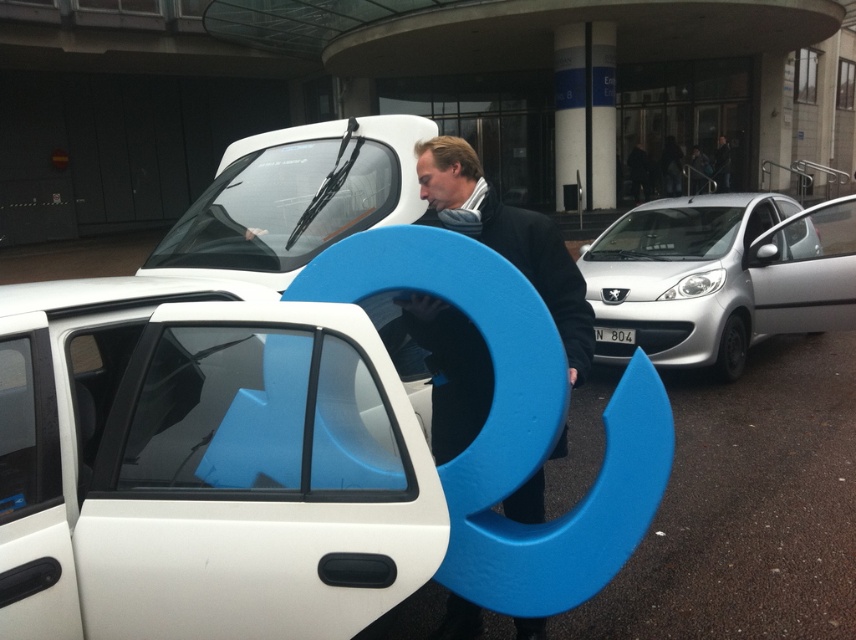
You are a delivery person who needs to place a package on the white matte car at center. The package is too heavy to lift over the car. Can you place the package directly in front of the white plastic license plate at center instead?

The white matte car at center is located above the white plastic license plate at center, so yes, you can place the package directly in front of the white plastic license plate at center since it is positioned below the car.

Looking at this image, you are a delivery person trying to read the license plate number on the white plastic license plate at center. However, the white matte car door at center is blocking your view. Can you move the car door to get a clear view of the license plate?

The white matte car door at center is in front of the white plastic license plate at center, so you cannot move the car door to get a clear view of the license plate since the door is blocking it.